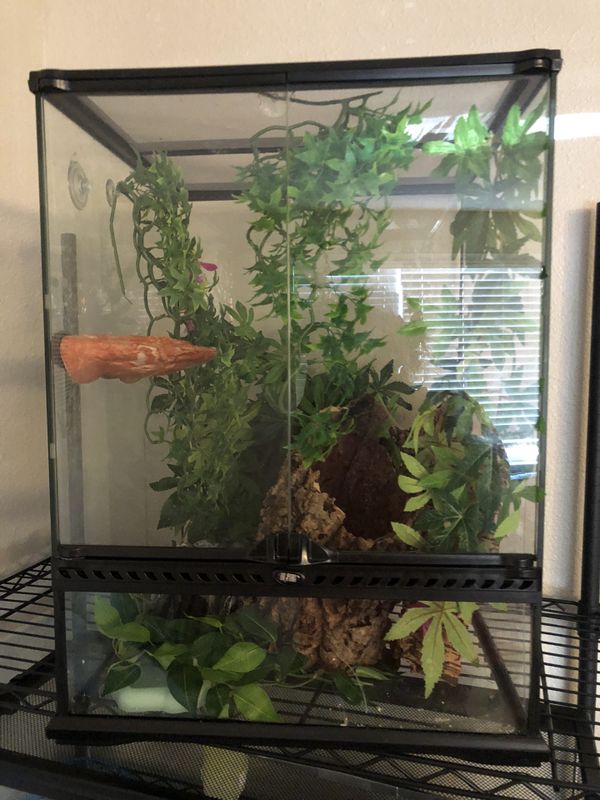
Locate an element on the screen. The width and height of the screenshot is (600, 800). shelf is located at coordinates (31, 630).